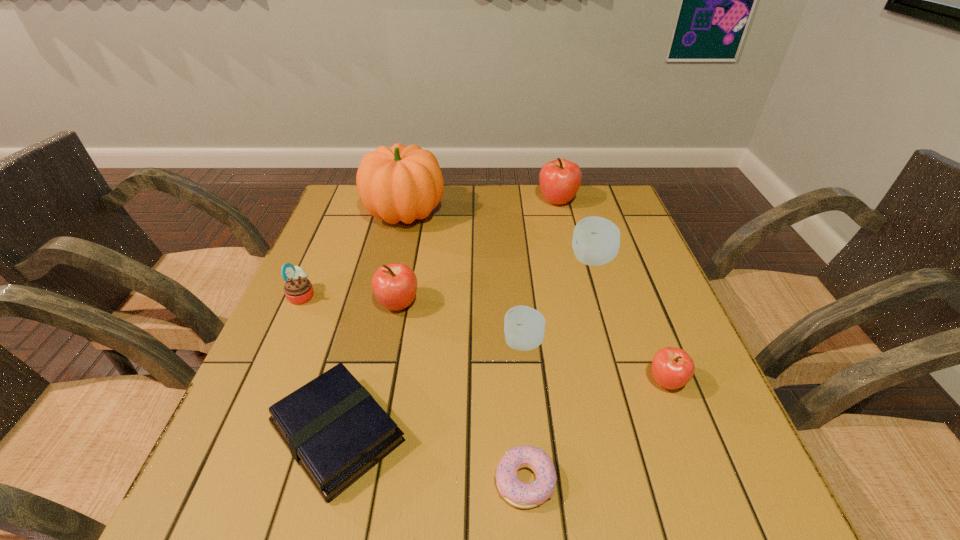
Identify the location of free location that satisfies the following two spatial constraints: 1. on the front-facing side of the pink muffin; 2. on the left side of the pink doughnut. (221, 481).

In order to click on blank area in the image that satisfies the following two spatial constraints: 1. on the front side of the leftmost apple; 2. on the left side of the rightmost pink apple in this screenshot , I will do `click(383, 382)`.